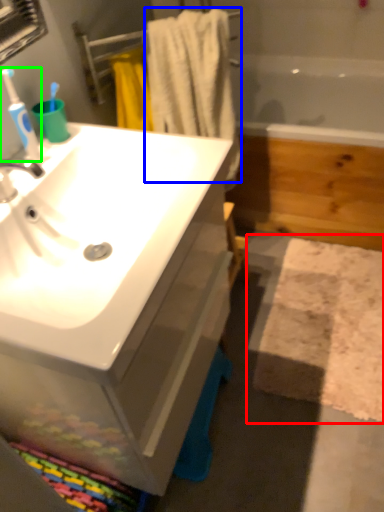
Question: Considering the real-world distances, which object is farthest from bath mat (highlighted by a red box)? bath towel (highlighted by a blue box) or toothbrush (highlighted by a green box)?

Choices:
 (A) bath towel
 (B) toothbrush

Answer: (B)